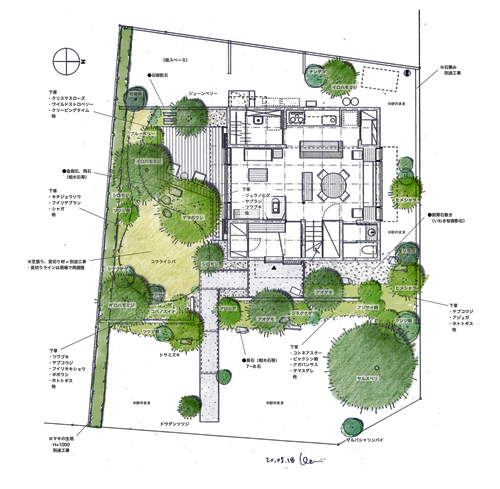
Where is `kitchen`? This screenshot has height=489, width=500. kitchen is located at coordinates (256, 155).